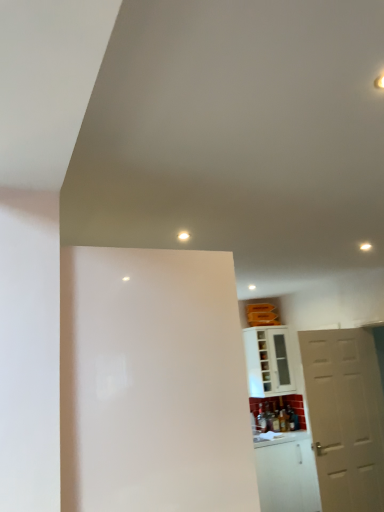
Question: Are white glossy screen door at center and white glossy cabinet at lower right located far from each other?

Choices:
 (A) yes
 (B) no

Answer: (A)

Question: From a real-world perspective, is white glossy screen door at center beneath white glossy cabinet at lower right?

Choices:
 (A) yes
 (B) no

Answer: (A)

Question: Can you confirm if white glossy screen door at center is wider than white glossy cabinet at lower right?

Choices:
 (A) yes
 (B) no

Answer: (A)

Question: Is white glossy screen door at center oriented away from white glossy cabinet at lower right?

Choices:
 (A) yes
 (B) no

Answer: (B)

Question: Considering the relative sizes of white glossy screen door at center and white glossy cabinet at lower right in the image provided, is white glossy screen door at center shorter than white glossy cabinet at lower right?

Choices:
 (A) no
 (B) yes

Answer: (A)

Question: Is white glossy screen door at center to the left of white glossy cabinet at lower right from the viewer's perspective?

Choices:
 (A) yes
 (B) no

Answer: (A)

Question: Does white glossy screen door at center appear on the left side of white matte door at right?

Choices:
 (A) yes
 (B) no

Answer: (A)

Question: Considering the relative sizes of white glossy screen door at center and white matte door at right in the image provided, is white glossy screen door at center smaller than white matte door at right?

Choices:
 (A) no
 (B) yes

Answer: (A)

Question: From a real-world perspective, does white glossy screen door at center stand above white matte door at right?

Choices:
 (A) no
 (B) yes

Answer: (B)

Question: Does white glossy screen door at center lie behind white matte door at right?

Choices:
 (A) yes
 (B) no

Answer: (B)

Question: Is the position of white glossy screen door at center less distant than that of white matte door at right?

Choices:
 (A) yes
 (B) no

Answer: (A)

Question: Considering the relative sizes of white glossy screen door at center and white matte door at right in the image provided, is white glossy screen door at center shorter than white matte door at right?

Choices:
 (A) no
 (B) yes

Answer: (B)

Question: Does white matte door at right have a greater height compared to white glossy screen door at center?

Choices:
 (A) no
 (B) yes

Answer: (B)